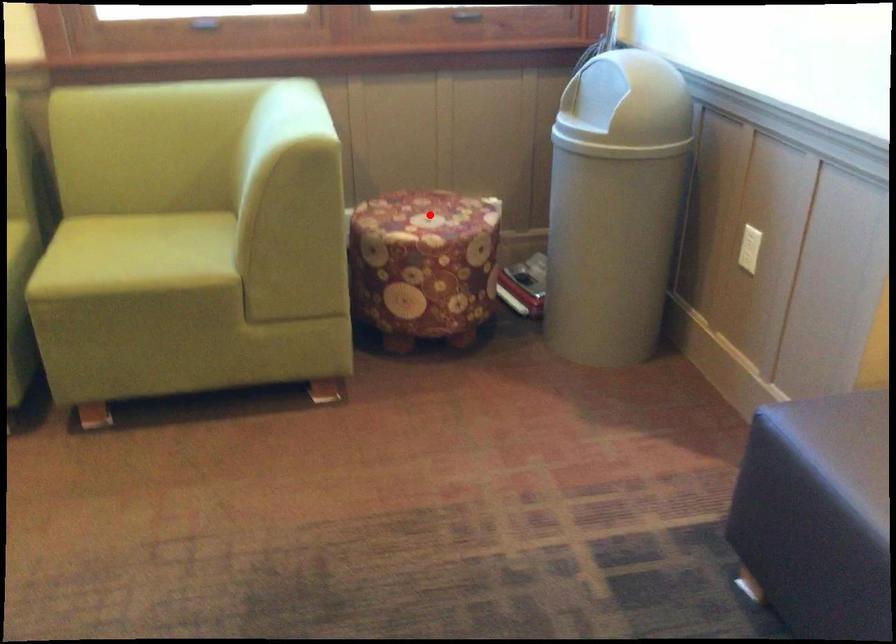
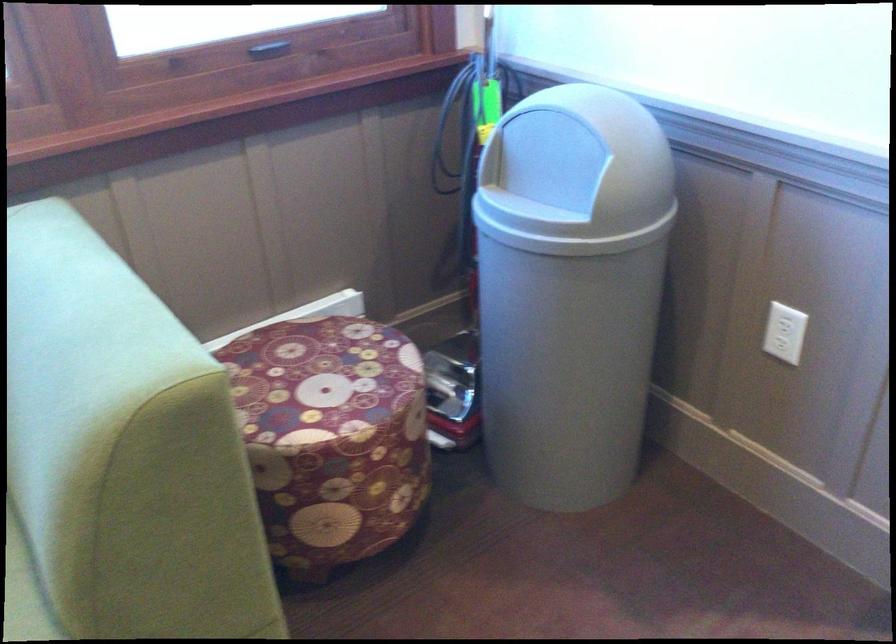
Find the pixel in the second image that matches the highlighted location in the first image.

(320, 373)